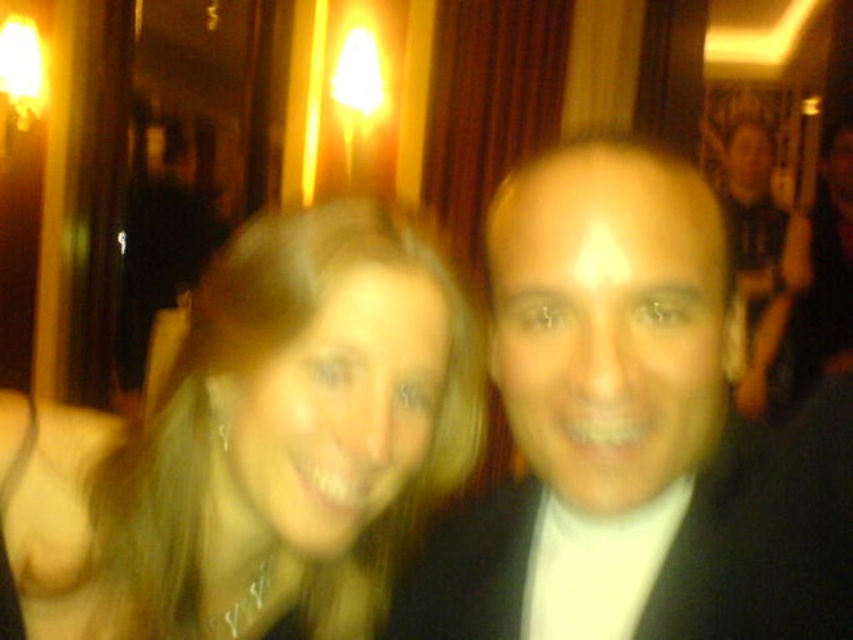
Question: Which object appears closest to the camera in this image?

Choices:
 (A) black satin suit at upper right
 (B) blonde hair at center

Answer: (B)

Question: Is blonde hair at center above black satin suit at upper right?

Choices:
 (A) no
 (B) yes

Answer: (A)

Question: Which point is farther to the camera?

Choices:
 (A) blonde hair at center
 (B) black satin suit at upper right

Answer: (B)

Question: Is blonde hair at center smaller than black satin suit at upper right?

Choices:
 (A) yes
 (B) no

Answer: (A)

Question: Can you confirm if blonde hair at center is wider than black satin suit at upper right?

Choices:
 (A) yes
 (B) no

Answer: (A)